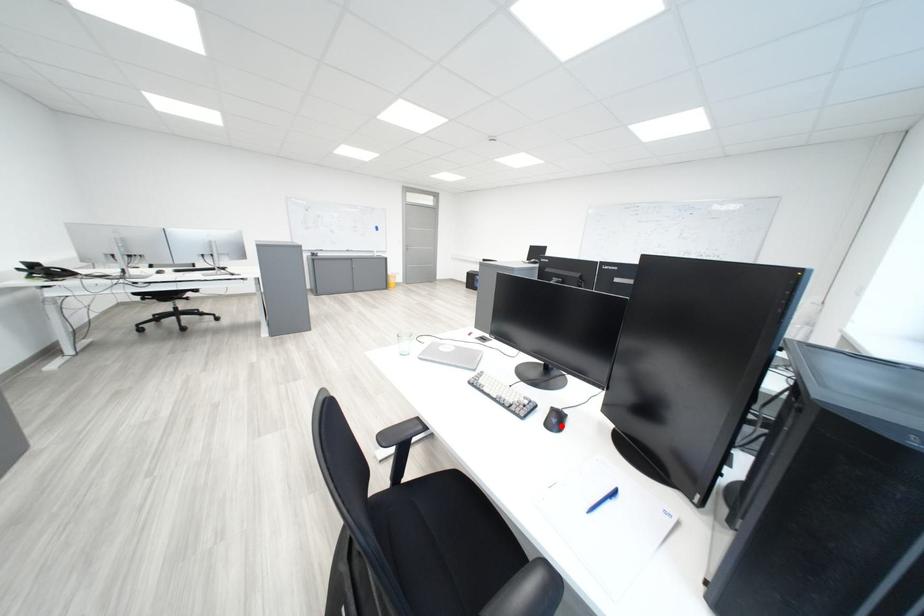
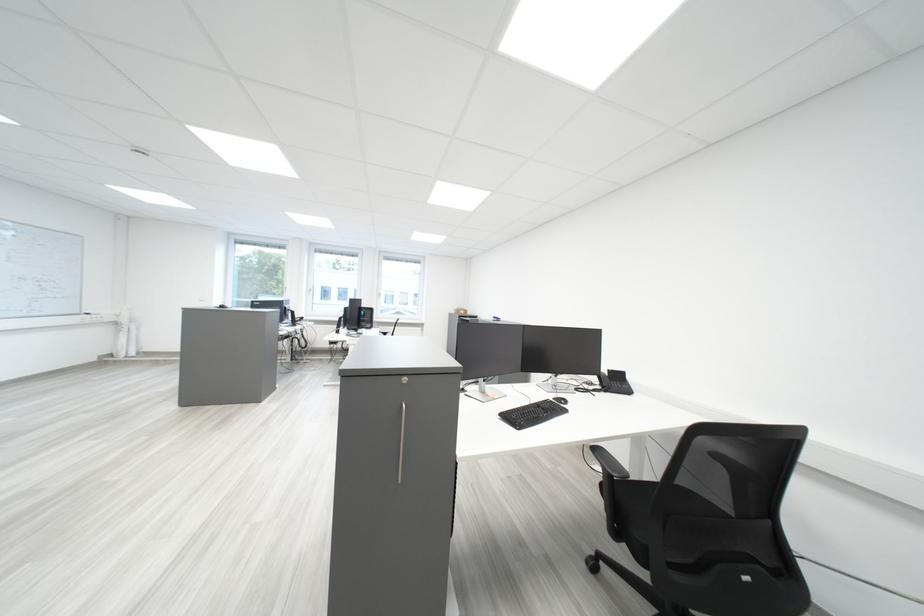
Question: I am providing you with two images of the same scene from different viewpoints. A red point is marked on the first image. Can you still see the location of the red point in image 2?

Choices:
 (A) Yes
 (B) No

Answer: (B)